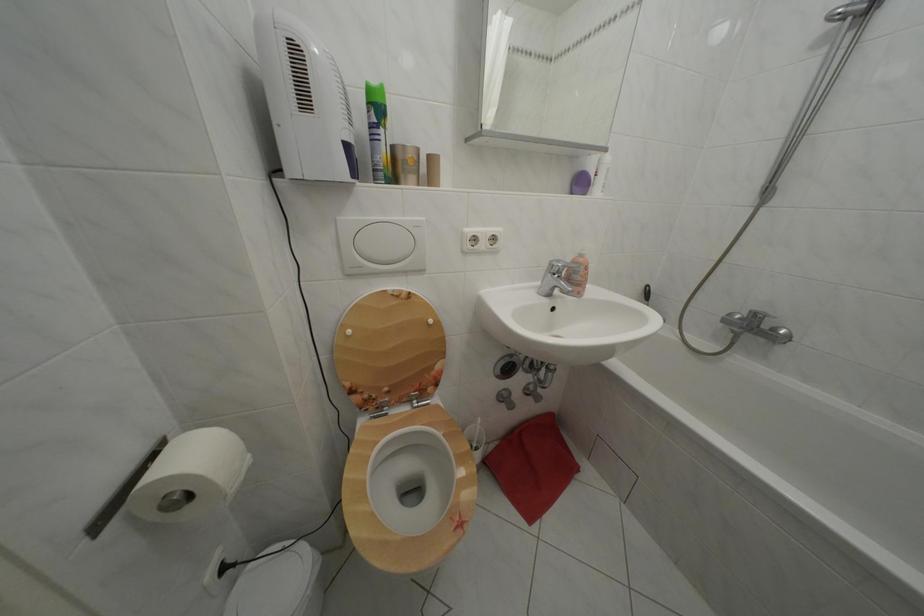
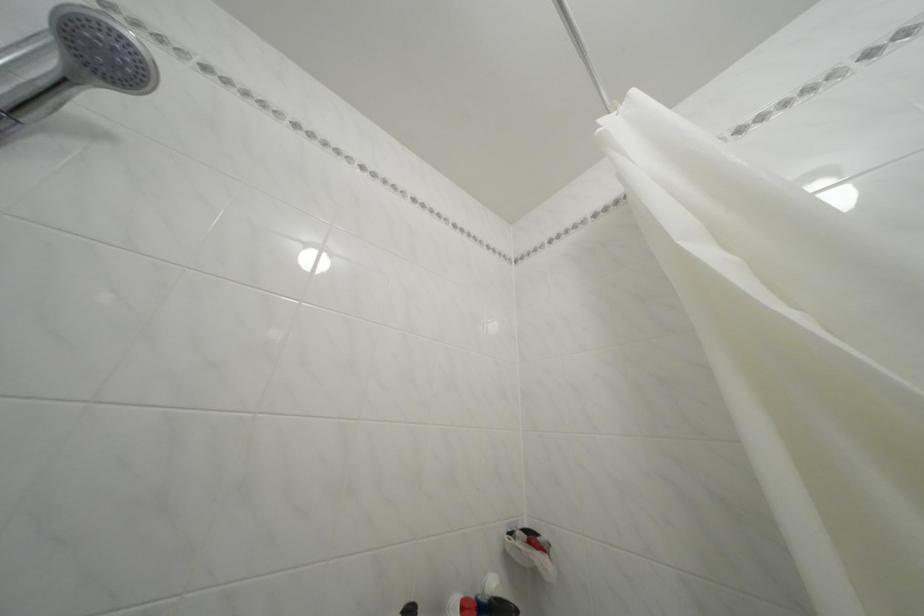
Based on the continuous images, in which direction is the camera rotating?

The camera rotated toward right-up.